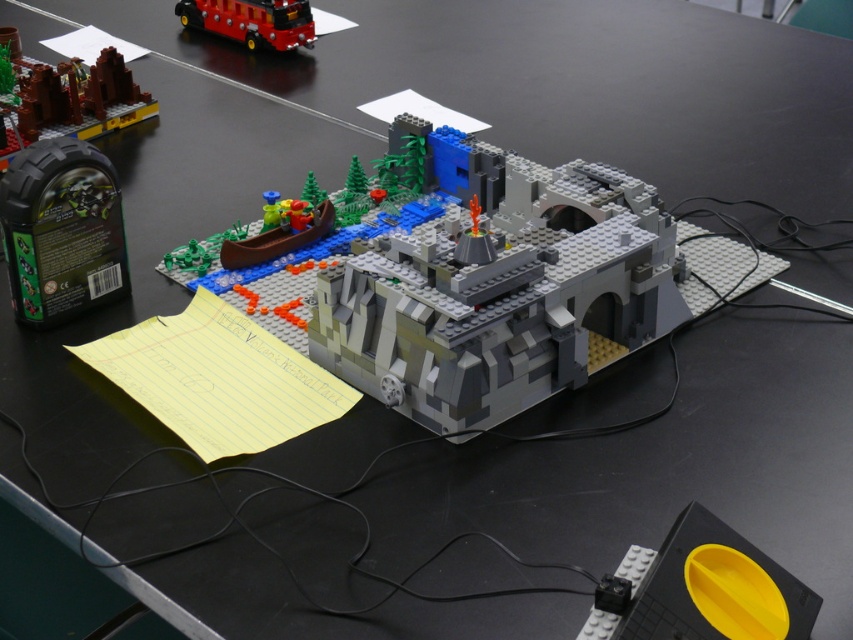
You are a miniature explorer standing on the yellow matte plate at lower right. Looking towards the gray matte volcano at center, can you see the top of the volcano?

The gray matte volcano at center has a greater height compared to the yellow matte plate at lower right, so yes, the explorer can see the top of the volcano from the yellow matte plate at lower right.

You are a delivery robot with a 30 cm wide package. You need to move from the brick red lego set at upper left to the shiny red bus at upper left. Is there enough space between them for your package?

The distance between the brick red lego set at upper left and the shiny red bus at upper left is 44.33 centimeters. Since your package is 30 cm wide, there is sufficient space to move through.